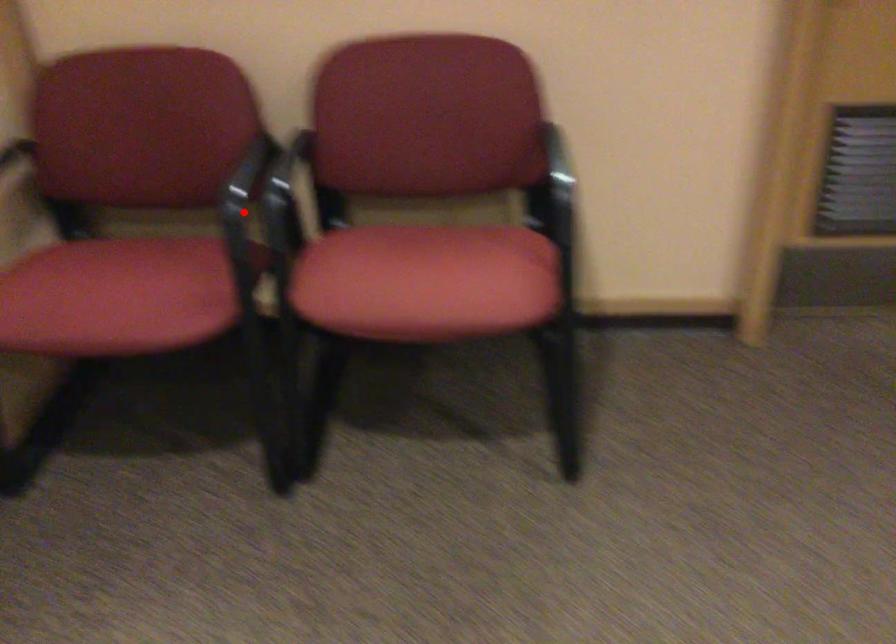
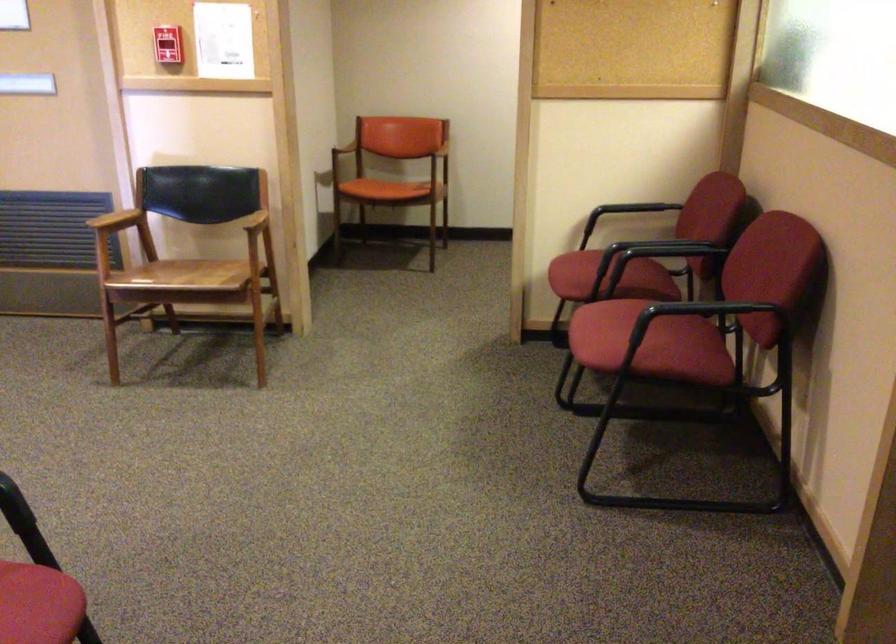
Question: I am providing you with two images of the same scene from different viewpoints. Given a red point in image1, look at the same physical point in image2. Is it:

Choices:
 (A) Closer to the viewpoint
 (B) Farther from the viewpoint

Answer: (B)